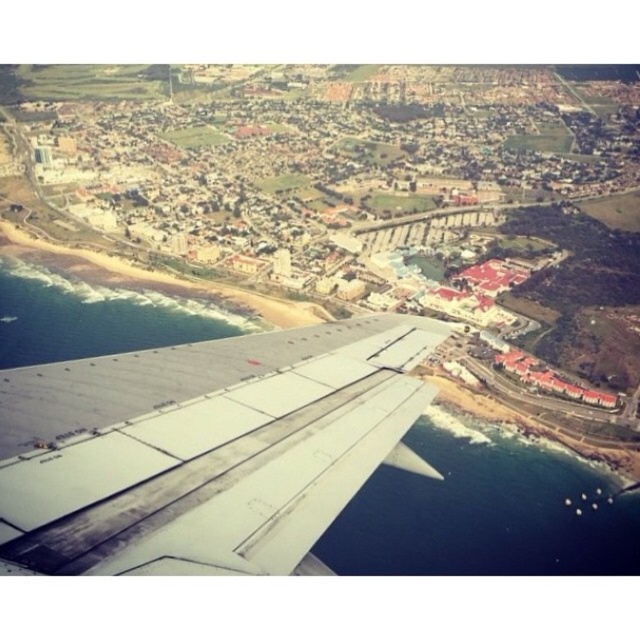
Is gray metallic wing at lower left shorter than deep blue water at lower right?

Yes.

Is point (138, 538) less distant than point (353, 502)?

Yes, it is in front of point (353, 502).

Is point (147, 422) positioned in front of point (509, 548)?

Yes.

Image resolution: width=640 pixels, height=640 pixels. Identify the location of gray metallic wing at lower left. click(220, 467).